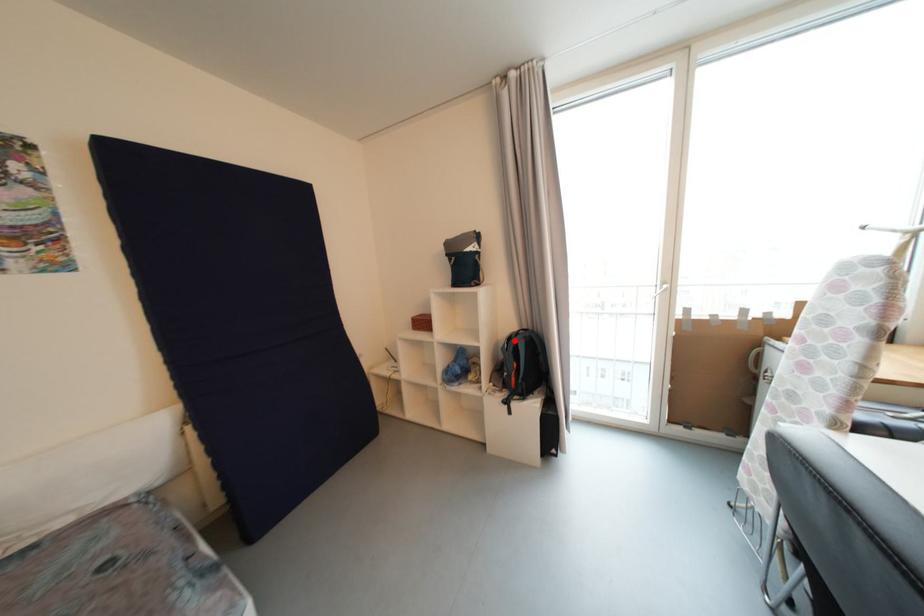
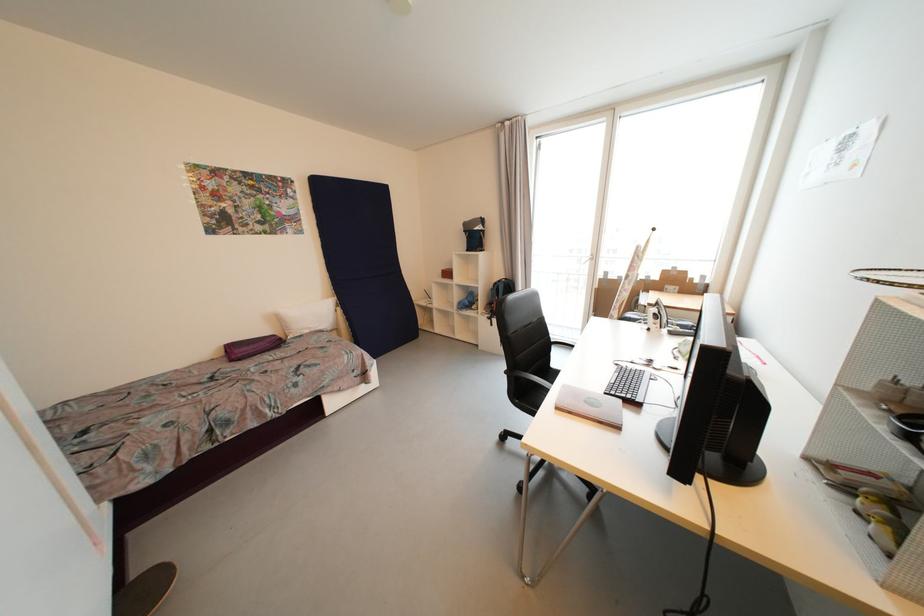
Find the pixel in the second image that matches the highlighted location in the first image.

(501, 285)